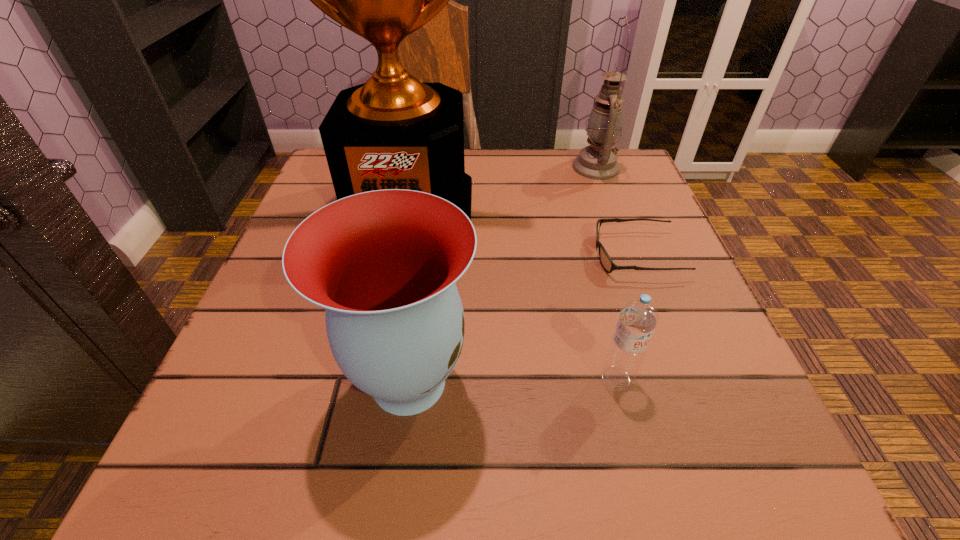
You are a GUI agent. You are given a task and a screenshot of the screen. Output one action in this format:
    pyautogui.click(x=<x>, y=<y>)
    Task: Click on the trophy cup
    This screenshot has height=540, width=960.
    Given the screenshot: What is the action you would take?
    pyautogui.click(x=392, y=132)

What are the coordinates of `the fourth shortest object` in the screenshot? It's located at (598, 161).

You are a GUI agent. You are given a task and a screenshot of the screen. Output one action in this format:
    pyautogui.click(x=<x>, y=<y>)
    Task: Click on the third tallest object
    Image resolution: width=960 pixels, height=540 pixels.
    Given the screenshot: What is the action you would take?
    pyautogui.click(x=384, y=263)

At what (x,y) coordinates should I click in order to perform the action: click on the second shortest object. Please return your answer as a coordinate pair (x, y). Looking at the image, I should click on (638, 318).

Where is `sunglasses`? sunglasses is located at coordinates (606, 261).

In order to click on vacant space located 0.350m on the front of the tallest object with the label in this screenshot , I will do `click(365, 411)`.

The image size is (960, 540). I want to click on free space located on the front of the second tallest object, so click(636, 278).

At what (x,y) coordinates should I click in order to perform the action: click on free space located 0.070m on the right of the third shortest object. Please return your answer as a coordinate pair (x, y). The height and width of the screenshot is (540, 960). Looking at the image, I should click on (527, 382).

Identify the location of vacant region located on the left of the water bottle. This screenshot has width=960, height=540. (333, 379).

Find the location of `free space located on the front-facing side of the shortest object`. free space located on the front-facing side of the shortest object is located at coordinates (405, 255).